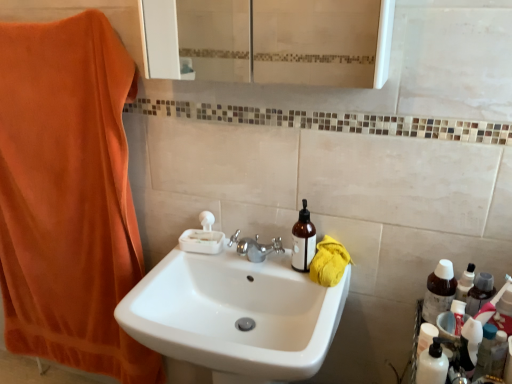
Where is `orange plush towel at left, which is counted as the 2th beach towel, starting from the bottom`? The image size is (512, 384). orange plush towel at left, which is counted as the 2th beach towel, starting from the bottom is located at coordinates (68, 196).

Identify the location of white glossy bottle at right. Image resolution: width=512 pixels, height=384 pixels. (498, 354).

Image resolution: width=512 pixels, height=384 pixels. Describe the element at coordinates (498, 354) in the screenshot. I see `white glossy bottle at right` at that location.

The width and height of the screenshot is (512, 384). I want to click on white opaque bottle at lower right, so click(433, 364).

How much space does matte brown bottle at center, marked as the 2th bottle in a right-to-left arrangement, occupy horizontally?

matte brown bottle at center, marked as the 2th bottle in a right-to-left arrangement, is 7.91 centimeters in width.

Where is `matte brown bottle at center, marked as the 2th bottle in a right-to-left arrangement`? matte brown bottle at center, marked as the 2th bottle in a right-to-left arrangement is located at coordinates (303, 240).

The height and width of the screenshot is (384, 512). What are the coordinates of `orange plush towel at left, placed as the 2th beach towel when sorted from right to left` in the screenshot? It's located at (68, 196).

Is white glossy bottle at right surrounded by brown matte bottle at right, acting as the 2th bottle starting from the left?

No, white glossy bottle at right is not inside brown matte bottle at right, acting as the 2th bottle starting from the left.

Considering the relative sizes of brown matte bottle at right, acting as the 2th bottle starting from the left, and white glossy bottle at right in the image provided, is brown matte bottle at right, acting as the 2th bottle starting from the left, thinner than white glossy bottle at right?

Yes, brown matte bottle at right, acting as the 2th bottle starting from the left, is thinner than white glossy bottle at right.

From the image's perspective, which is below, brown matte bottle at right, which is counted as the first bottle, starting from the right, or white glossy bottle at right?

white glossy bottle at right, from the image's perspective.

Based on the photo, is white opaque bottle at lower right a part of orange plush towel at left, which is counted as the 2th beach towel, starting from the bottom?

That's incorrect, white opaque bottle at lower right is not inside orange plush towel at left, which is counted as the 2th beach towel, starting from the bottom.

From a real-world perspective, is orange plush towel at left, arranged as the 1th beach towel when viewed from the left, physically located above or below white opaque bottle at lower right?

orange plush towel at left, arranged as the 1th beach towel when viewed from the left, is below white opaque bottle at lower right.

Consider the image. Is orange plush towel at left, the first beach towel when ordered from top to bottom, oriented away from white opaque bottle at lower right?

No, orange plush towel at left, the first beach towel when ordered from top to bottom, is not facing the opposite direction of white opaque bottle at lower right.

Consider the image. Considering the sizes of orange plush towel at left, the first beach towel when ordered from top to bottom, and white opaque bottle at lower right in the image, is orange plush towel at left, the first beach towel when ordered from top to bottom, wider or thinner than white opaque bottle at lower right?

Considering their sizes, orange plush towel at left, the first beach towel when ordered from top to bottom, looks broader than white opaque bottle at lower right.

Measure the distance from white glossy sink at center to white opaque bottle at lower right.

white glossy sink at center and white opaque bottle at lower right are 19.20 inches apart from each other.

Between white glossy sink at center and white opaque bottle at lower right, which one has larger size?

With larger size is white glossy sink at center.

Is the position of white glossy sink at center less distant than that of white opaque bottle at lower right?

Yes.

Which is farther, (160,262) or (421,376)?

The point (160,262) is farther from the camera.

From their relative heights in the image, would you say white glossy sink at center is taller or shorter than yellow cotton towel at right, marked as the 2th beach towel in a left-to-right arrangement?

Clearly, white glossy sink at center is taller compared to yellow cotton towel at right, marked as the 2th beach towel in a left-to-right arrangement.

Based on the photo, between white glossy sink at center and yellow cotton towel at right, marked as the first beach towel in a right-to-left arrangement, which one is positioned in front?

white glossy sink at center is more forward.

From the image's perspective, which is below, white glossy sink at center or yellow cotton towel at right, the 2th beach towel from the top?

From the image's view, white glossy sink at center is below.

Where is `beach towel that is the 1st object above the white glossy sink at center (from a real-world perspective)`? The width and height of the screenshot is (512, 384). beach towel that is the 1st object above the white glossy sink at center (from a real-world perspective) is located at coordinates (68, 196).

From the image's perspective, is orange plush towel at left, which is counted as the 2th beach towel, starting from the bottom, beneath white glossy sink at center?

No.

Can you confirm if orange plush towel at left, arranged as the 1th beach towel when viewed from the left, is positioned to the right of white glossy sink at center?

No.

From a real-world perspective, who is located lower, orange plush towel at left, which is counted as the 2th beach towel, starting from the bottom, or white glossy sink at center?

white glossy sink at center, from a real-world perspective.

Which of these two, matte brown bottle at center, marked as the 2th bottle in a right-to-left arrangement, or brown matte bottle at right, acting as the 2th bottle starting from the left, stands taller?

brown matte bottle at right, acting as the 2th bottle starting from the left.

From a real-world perspective, does matte brown bottle at center, arranged as the first bottle when viewed from the left, sit lower than brown matte bottle at right, which is counted as the first bottle, starting from the right?

No, from a real-world perspective, matte brown bottle at center, arranged as the first bottle when viewed from the left, is not beneath brown matte bottle at right, which is counted as the first bottle, starting from the right.

Which is in front, matte brown bottle at center, arranged as the first bottle when viewed from the left, or brown matte bottle at right, which is counted as the first bottle, starting from the right?

brown matte bottle at right, which is counted as the first bottle, starting from the right.

Considering the points (436, 380) and (173, 294), which point is behind, point (436, 380) or point (173, 294)?

Positioned behind is point (173, 294).

Consider the image. Is white opaque bottle at lower right outside of white glossy sink at center?

Yes, white opaque bottle at lower right is outside of white glossy sink at center.

This screenshot has width=512, height=384. In order to click on sink located below the white opaque bottle at lower right (from the image's perspective) in this screenshot , I will do `click(234, 315)`.

From the image's perspective, is white opaque bottle at lower right under white glossy sink at center?

No, from the image's perspective, white opaque bottle at lower right is not below white glossy sink at center.

Where is `bottle that is the 1st one when counting leftward from the white glossy bottle at right`? The width and height of the screenshot is (512, 384). bottle that is the 1st one when counting leftward from the white glossy bottle at right is located at coordinates (439, 291).

Where is `cleaning product on the right of orange plush towel at left, placed as the 2th beach towel when sorted from right to left`? cleaning product on the right of orange plush towel at left, placed as the 2th beach towel when sorted from right to left is located at coordinates (433, 364).

Based on their spatial positions, is brown matte bottle at right, acting as the 2th bottle starting from the left, or white opaque bottle at lower right closer to orange plush towel at left, which is counted as the 2th beach towel, starting from the bottom?

brown matte bottle at right, acting as the 2th bottle starting from the left.

Based on their spatial positions, is matte brown bottle at center, arranged as the first bottle when viewed from the left, or yellow cotton towel at right, marked as the 2th beach towel in a left-to-right arrangement, further from brown matte bottle at right, acting as the 2th bottle starting from the left?

matte brown bottle at center, arranged as the first bottle when viewed from the left.

Looking at this image, estimate the real-world distances between objects in this image. Which object is closer to white glossy bottle at right, yellow cotton towel at right, acting as the first beach towel starting from the bottom, or brown matte bottle at right, which is counted as the first bottle, starting from the right?

The object closer to white glossy bottle at right is brown matte bottle at right, which is counted as the first bottle, starting from the right.

Considering their positions, is white glossy bottle at right positioned further to brown matte bottle at right, which is counted as the first bottle, starting from the right, than matte brown bottle at center, arranged as the first bottle when viewed from the left?

Based on the image, matte brown bottle at center, arranged as the first bottle when viewed from the left, appears to be further to brown matte bottle at right, which is counted as the first bottle, starting from the right.

Based on their spatial positions, is white glossy sink at center or yellow cotton towel at right, the 2th beach towel from the top, further from brown matte bottle at right, acting as the 2th bottle starting from the left?

Based on the image, white glossy sink at center appears to be further to brown matte bottle at right, acting as the 2th bottle starting from the left.

From the image, which object appears to be nearer to orange plush towel at left, placed as the 2th beach towel when sorted from right to left, white glossy bottle at right or brown matte bottle at right, which is counted as the first bottle, starting from the right?

brown matte bottle at right, which is counted as the first bottle, starting from the right, is closer to orange plush towel at left, placed as the 2th beach towel when sorted from right to left.

From the image, which object appears to be farther from matte brown bottle at center, arranged as the first bottle when viewed from the left, orange plush towel at left, arranged as the 1th beach towel when viewed from the left, or white opaque bottle at lower right?

orange plush towel at left, arranged as the 1th beach towel when viewed from the left, is further to matte brown bottle at center, arranged as the first bottle when viewed from the left.

When comparing their distances from brown matte bottle at right, which is counted as the first bottle, starting from the right, does yellow cotton towel at right, acting as the first beach towel starting from the bottom, or matte brown bottle at center, arranged as the first bottle when viewed from the left, seem closer?

yellow cotton towel at right, acting as the first beach towel starting from the bottom, is closer to brown matte bottle at right, which is counted as the first bottle, starting from the right.

Locate an element on the screen. This screenshot has width=512, height=384. bottle between orange plush towel at left, placed as the 2th beach towel when sorted from right to left, and white opaque bottle at lower right, in the horizontal direction is located at coordinates (303, 240).

Where is `bottle located between white opaque bottle at lower right and white glossy bottle at right in the left-right direction`? bottle located between white opaque bottle at lower right and white glossy bottle at right in the left-right direction is located at coordinates (439, 291).

Locate an element on the screen. cleaning product between white glossy sink at center and white glossy bottle at right from left to right is located at coordinates (433, 364).

You are a GUI agent. You are given a task and a screenshot of the screen. Output one action in this format:
    pyautogui.click(x=<x>, y=<y>)
    Task: Click on the cleaning product situated between yellow cotton towel at right, marked as the 2th beach towel in a left-to-right arrangement, and white glossy bottle at right from left to right
    This screenshot has width=512, height=384.
    Given the screenshot: What is the action you would take?
    pyautogui.click(x=433, y=364)